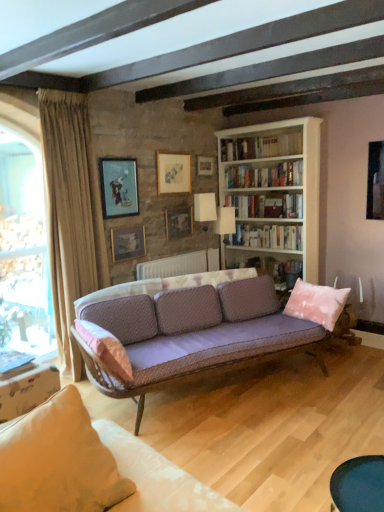
Question: From the image's perspective, is white paper bookshelf at upper center, which is counted as the 2th book, starting from the bottom, above beige fabric pillow at lower left, the first pillow viewed from the left?

Choices:
 (A) yes
 (B) no

Answer: (A)

Question: Can you confirm if white paper bookshelf at upper center, which appears as the 4th book when viewed from the top, is shorter than beige fabric pillow at lower left, the second pillow viewed from the back?

Choices:
 (A) no
 (B) yes

Answer: (B)

Question: Is white paper bookshelf at upper center, which is counted as the 2th book, starting from the bottom, positioned with its back to beige fabric pillow at lower left, arranged as the 1th pillow when viewed from the front?

Choices:
 (A) no
 (B) yes

Answer: (A)

Question: From a real-world perspective, is white paper bookshelf at upper center, which is counted as the 2th book, starting from the bottom, located higher than beige fabric pillow at lower left, which is the 2th pillow from right to left?

Choices:
 (A) no
 (B) yes

Answer: (B)

Question: Could you tell me if white paper bookshelf at upper center, which is counted as the 2th book, starting from the bottom, is facing beige fabric pillow at lower left, arranged as the 1th pillow when viewed from the front?

Choices:
 (A) no
 (B) yes

Answer: (B)

Question: Is white paper bookshelf at upper center, which is counted as the 2th book, starting from the bottom, surrounding beige fabric pillow at lower left, arranged as the 1th pillow when viewed from the front?

Choices:
 (A) no
 (B) yes

Answer: (A)

Question: Considering the relative sizes of wooden picture frame at upper center, arranged as the first picture frame when viewed from the right, and beige fabric pillow at lower left, which is the 2th pillow from right to left, in the image provided, is wooden picture frame at upper center, arranged as the first picture frame when viewed from the right, shorter than beige fabric pillow at lower left, which is the 2th pillow from right to left,?

Choices:
 (A) no
 (B) yes

Answer: (B)

Question: Is wooden picture frame at upper center, arranged as the first picture frame when viewed from the right, not within beige fabric pillow at lower left, arranged as the 1th pillow when viewed from the front?

Choices:
 (A) no
 (B) yes

Answer: (B)

Question: Is the position of wooden picture frame at upper center, arranged as the first picture frame when viewed from the right, less distant than that of beige fabric pillow at lower left, the first pillow viewed from the left?

Choices:
 (A) yes
 (B) no

Answer: (B)

Question: Does wooden picture frame at upper center, which ranks as the 5th picture frame in left-to-right order, contain beige fabric pillow at lower left, the second pillow viewed from the back?

Choices:
 (A) no
 (B) yes

Answer: (A)

Question: Can you confirm if wooden picture frame at upper center, arranged as the first picture frame when viewed from the right, is thinner than beige fabric pillow at lower left, the second pillow viewed from the back?

Choices:
 (A) yes
 (B) no

Answer: (A)

Question: Is beige fabric pillow at lower left, the second pillow viewed from the back, at the back of wooden picture frame at upper center, arranged as the first picture frame when viewed from the right?

Choices:
 (A) no
 (B) yes

Answer: (A)

Question: Is white paper bookshelf at upper center, which is counted as the 2th book, starting from the bottom, to the right of hardcover book at lower left, which is counted as the fifth book, starting from the top, from the viewer's perspective?

Choices:
 (A) no
 (B) yes

Answer: (B)